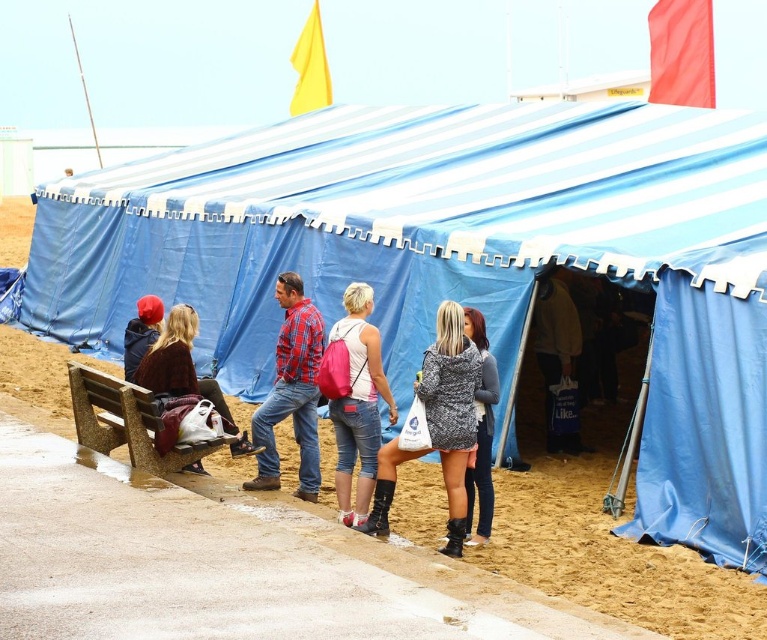
Consider the image. Is plaid shirt at center positioned in front of matte black jacket at left?

Yes, it is.

Can you confirm if plaid shirt at center is taller than matte black jacket at left?

Indeed, plaid shirt at center has a greater height compared to matte black jacket at left.

Who is more forward, (x=311, y=403) or (x=142, y=349)?

Positioned in front is point (x=311, y=403).

Find the location of a particular element. Image resolution: width=767 pixels, height=640 pixels. plaid shirt at center is located at coordinates tap(291, 392).

Who is positioned more to the left, pink fabric backpack at center or patterned fabric dress at center?

pink fabric backpack at center

Is point (369, 337) behind point (489, 442)?

That is True.

Find the location of `pink fabric backpack at center`. pink fabric backpack at center is located at coordinates (357, 404).

Is matte brown jacket at left to the left of patterned fabric dress at center from the viewer's perspective?

Indeed, matte brown jacket at left is positioned on the left side of patterned fabric dress at center.

Who is more distant from viewer, (198, 470) or (482, 468)?

The point (198, 470) is more distant.

Describe the element at coordinates (173, 364) in the screenshot. The width and height of the screenshot is (767, 640). I see `matte brown jacket at left` at that location.

What are the coordinates of `matte brown jacket at left` in the screenshot? It's located at (173, 364).